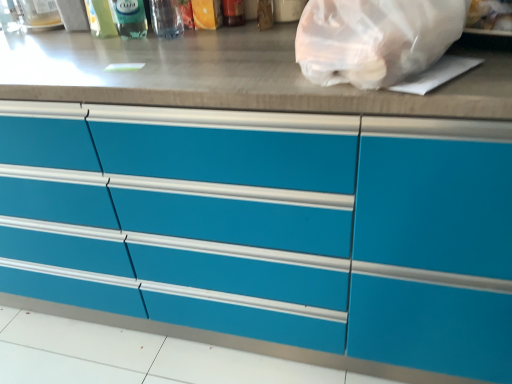
Locate an element on the screen. vacant area that is in front of transparent plastic bottle at upper center, placed as the third bottle when sorted from left to right is located at coordinates (165, 50).